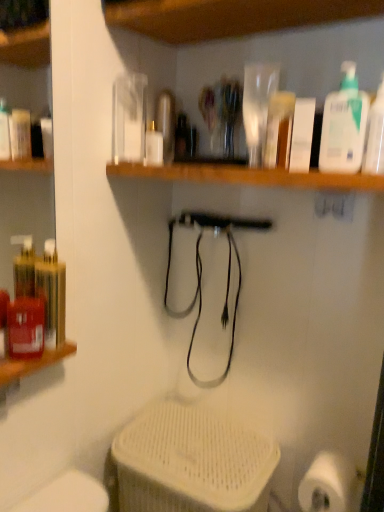
Question: Does white matte bottle at center turn towards white plastic pump bottle at upper right, arranged as the first cleaning product when viewed from the left?

Choices:
 (A) yes
 (B) no

Answer: (B)

Question: Would you consider white matte bottle at center to be distant from white plastic pump bottle at upper right, positioned as the 2th cleaning product in right-to-left order?

Choices:
 (A) no
 (B) yes

Answer: (A)

Question: Can you confirm if white matte bottle at center is taller than white plastic pump bottle at upper right, positioned as the 2th cleaning product in right-to-left order?

Choices:
 (A) no
 (B) yes

Answer: (A)

Question: Can you confirm if white matte bottle at center is bigger than white plastic pump bottle at upper right, positioned as the 2th cleaning product in right-to-left order?

Choices:
 (A) no
 (B) yes

Answer: (A)

Question: Is white matte bottle at center next to white plastic pump bottle at upper right, positioned as the 2th cleaning product in right-to-left order, and touching it?

Choices:
 (A) yes
 (B) no

Answer: (B)

Question: Can you confirm if white matte bottle at center is positioned to the left of white plastic pump bottle at upper right, arranged as the first cleaning product when viewed from the left?

Choices:
 (A) yes
 (B) no

Answer: (A)

Question: Can you confirm if white plastic pump bottle at upper right, arranged as the first cleaning product when viewed from the left, is bigger than white matte bottle at center?

Choices:
 (A) no
 (B) yes

Answer: (B)

Question: Is white plastic pump bottle at upper right, arranged as the first cleaning product when viewed from the left, next to white matte bottle at center and touching it?

Choices:
 (A) no
 (B) yes

Answer: (A)

Question: Does white plastic pump bottle at upper right, positioned as the 2th cleaning product in right-to-left order, appear on the left side of white matte bottle at center?

Choices:
 (A) yes
 (B) no

Answer: (B)

Question: Can you confirm if white plastic pump bottle at upper right, arranged as the first cleaning product when viewed from the left, is wider than white matte bottle at center?

Choices:
 (A) yes
 (B) no

Answer: (B)

Question: Can you confirm if white plastic pump bottle at upper right, positioned as the 2th cleaning product in right-to-left order, is thinner than white matte bottle at center?

Choices:
 (A) no
 (B) yes

Answer: (B)

Question: Is white plastic pump bottle at upper right, positioned as the 2th cleaning product in right-to-left order, not inside white matte bottle at center?

Choices:
 (A) yes
 (B) no

Answer: (A)

Question: From the image's perspective, is translucent plastic bottle at upper right, marked as the 2th cleaning product in a left-to-right arrangement, beneath white matte bottle at center?

Choices:
 (A) no
 (B) yes

Answer: (B)